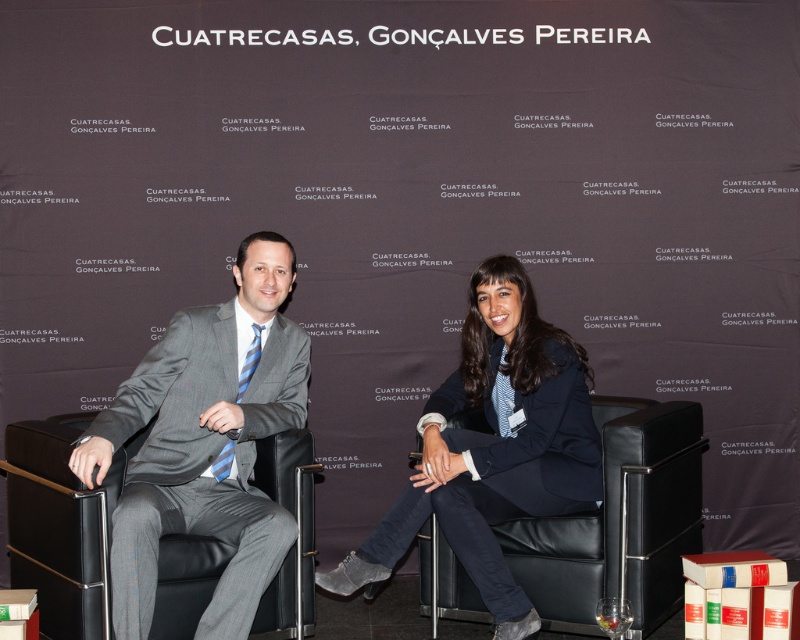
Question: Which object appears farthest from the camera in this image?

Choices:
 (A) gray pinstripe suit at left
 (B) gray suit at center
 (C) black leather armchair at center

Answer: (C)

Question: Observing the image, what is the correct spatial positioning of navy blue blazer at center in reference to gray leather armchair at left?

Choices:
 (A) above
 (B) below

Answer: (A)

Question: Which object appears farthest from the camera in this image?

Choices:
 (A) black leather armchair at center
 (B) gray leather armchair at left

Answer: (A)

Question: Is gray pinstripe suit at left thinner than black leather armchair at center?

Choices:
 (A) yes
 (B) no

Answer: (A)

Question: Which point is closer to the camera?

Choices:
 (A) gray suit at center
 (B) gray leather armchair at left
 (C) navy blue blazer at center
 (D) black leather armchair at center

Answer: (B)

Question: Is gray suit at center below gray leather armchair at left?

Choices:
 (A) no
 (B) yes

Answer: (A)